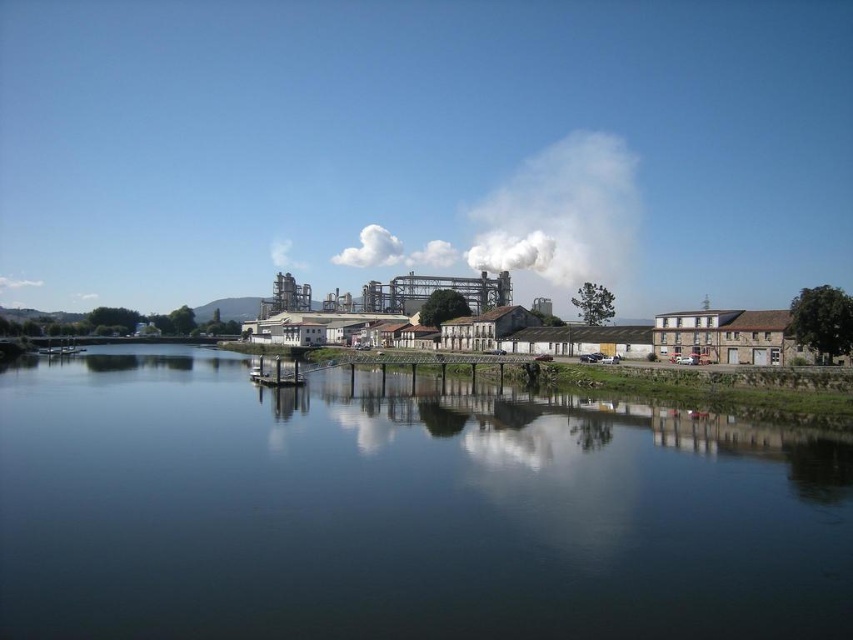
You are standing at the edge of the river and want to place a 40 meter long floating dock. The dock must be placed from the dark blue water at center to the industrial buildings on the right. Will the dock fit?

The distance between the dark blue water at center and the industrial buildings on the right is 39.04 meters. Since the dock is 40 meters long, it will not fit as it is longer than the available space.

You are a photographer planning to capture the industrial complex and its reflection in the river. Based on the scene, which object, the dark blue water at center or the white smoke at upper center, is positioned lower in the image?

The dark blue water at center is positioned lower in the image than the white smoke at upper center because the description states that the dark blue water at center is not as tall as the white smoke at upper center.